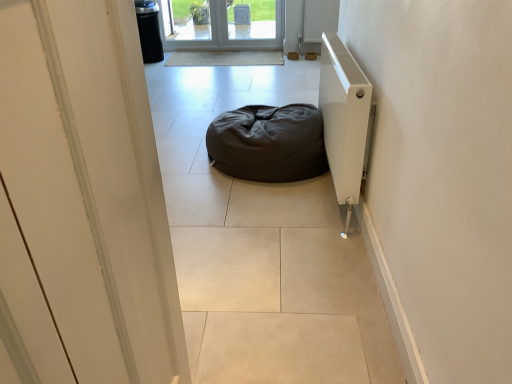
Where is `free space in front of white textured radiator at right`? The image size is (512, 384). free space in front of white textured radiator at right is located at coordinates (293, 252).